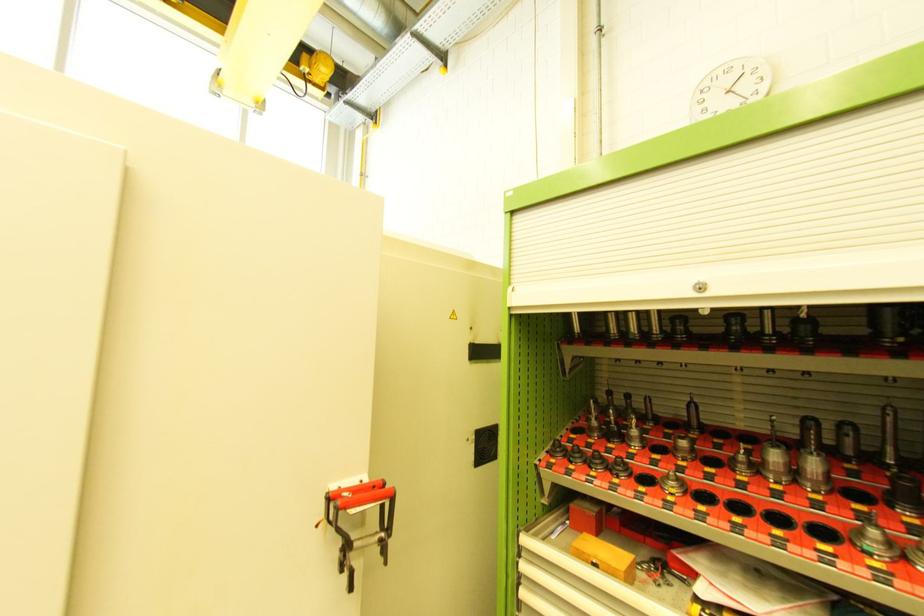
Where would you turn the shutter door lock? Please return your answer as a coordinate pair (x, y).

(484, 445)